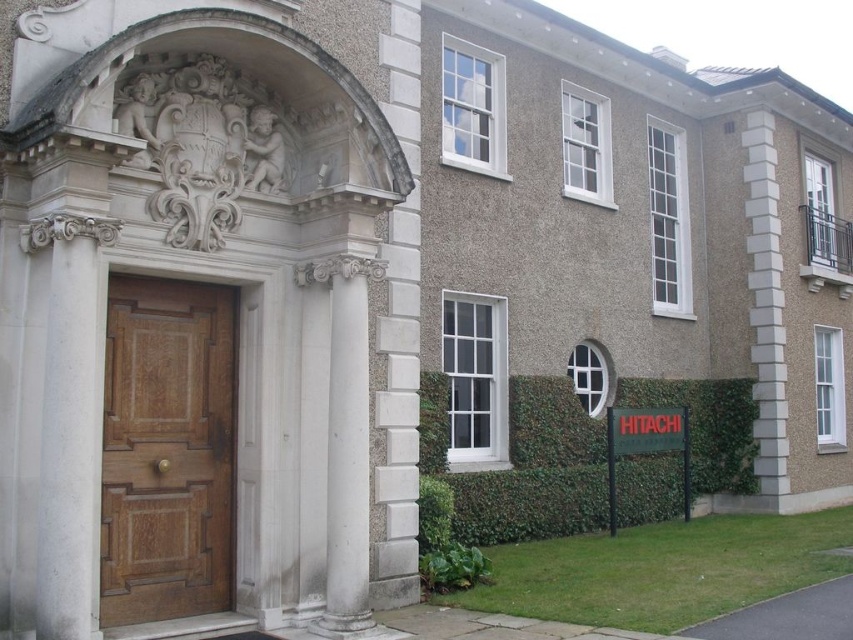
What do you see at coordinates (167, 451) in the screenshot? I see `wooden panelled door at center` at bounding box center [167, 451].

Who is lower down, wooden panelled door at center or green ivy hedge at lower right?

green ivy hedge at lower right is below.

Between point (198, 605) and point (689, 468), which one is positioned behind?

Point (689, 468)

Identify the location of wooden panelled door at center. This screenshot has height=640, width=853. (167, 451).